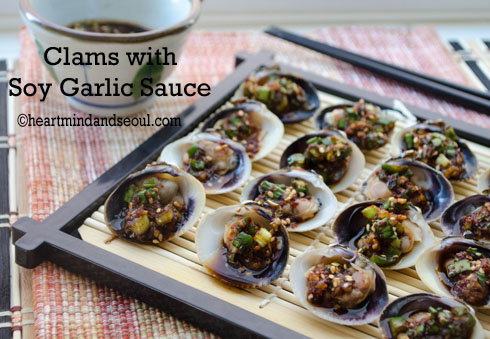
Identify the location of ramekin. Image resolution: width=490 pixels, height=339 pixels. (161, 35).